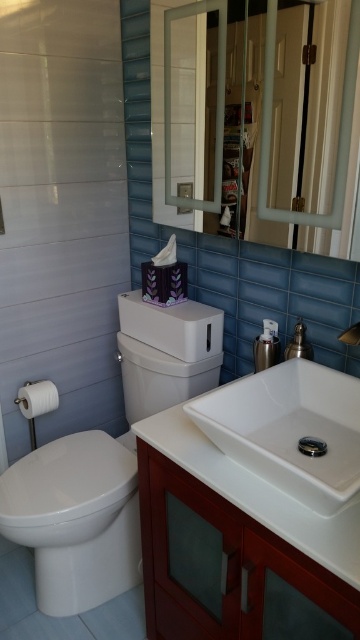
Does clear glass mirror at upper center come in front of polished chrome faucet at upper right?

Yes, it is in front of polished chrome faucet at upper right.

Does clear glass mirror at upper center appear over polished chrome faucet at upper right?

Yes, clear glass mirror at upper center is above polished chrome faucet at upper right.

Does point (164, 13) lie in front of point (299, 337)?

No, it is behind (299, 337).

Identify the location of clear glass mirror at upper center. The height and width of the screenshot is (640, 360). (339, 125).

Based on the photo, is mahogany wood vanity at lower right to the left of clear glass mirror at upper center from the viewer's perspective?

Yes, mahogany wood vanity at lower right is to the left of clear glass mirror at upper center.

Which of these two, mahogany wood vanity at lower right or clear glass mirror at upper center, stands taller?

clear glass mirror at upper center

The height and width of the screenshot is (640, 360). Describe the element at coordinates (219, 563) in the screenshot. I see `mahogany wood vanity at lower right` at that location.

Where is `mahogany wood vanity at lower right`? Image resolution: width=360 pixels, height=640 pixels. mahogany wood vanity at lower right is located at coordinates (219, 563).

Is white glossy toilet bowl at left smaller than clear glass mirror at upper center?

Actually, white glossy toilet bowl at left might be larger than clear glass mirror at upper center.

The height and width of the screenshot is (640, 360). What are the coordinates of `white glossy toilet bowl at left` in the screenshot? It's located at (75, 518).

Locate an element on the screen. white glossy toilet bowl at left is located at coordinates (75, 518).